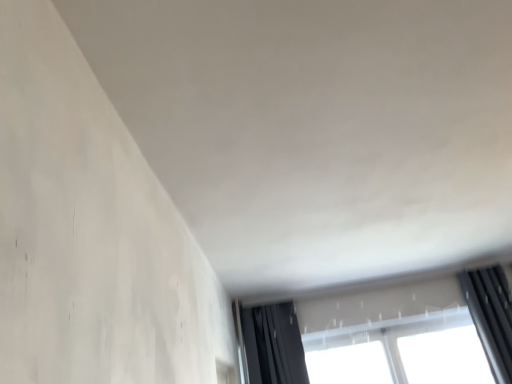
Question: From a real-world perspective, is black fabric curtain at upper right positioned above or below transparent glass window at lower right?

Choices:
 (A) above
 (B) below

Answer: (B)

Question: Do you think black fabric curtain at upper right is within transparent glass window at lower right, or outside of it?

Choices:
 (A) inside
 (B) outside

Answer: (B)

Question: Is point (480, 329) positioned closer to the camera than point (305, 379)?

Choices:
 (A) farther
 (B) closer

Answer: (B)

Question: Choose the correct answer: Is transparent glass window at lower right inside black fabric curtain at upper right or outside it?

Choices:
 (A) inside
 (B) outside

Answer: (B)

Question: From their relative heights in the image, would you say transparent glass window at lower right is taller or shorter than black fabric curtain at upper right?

Choices:
 (A) tall
 (B) short

Answer: (B)

Question: Based on their sizes in the image, would you say transparent glass window at lower right is bigger or smaller than black fabric curtain at upper right?

Choices:
 (A) big
 (B) small

Answer: (B)

Question: Visually, is transparent glass window at lower right positioned to the left or to the right of black fabric curtain at upper right?

Choices:
 (A) right
 (B) left

Answer: (B)